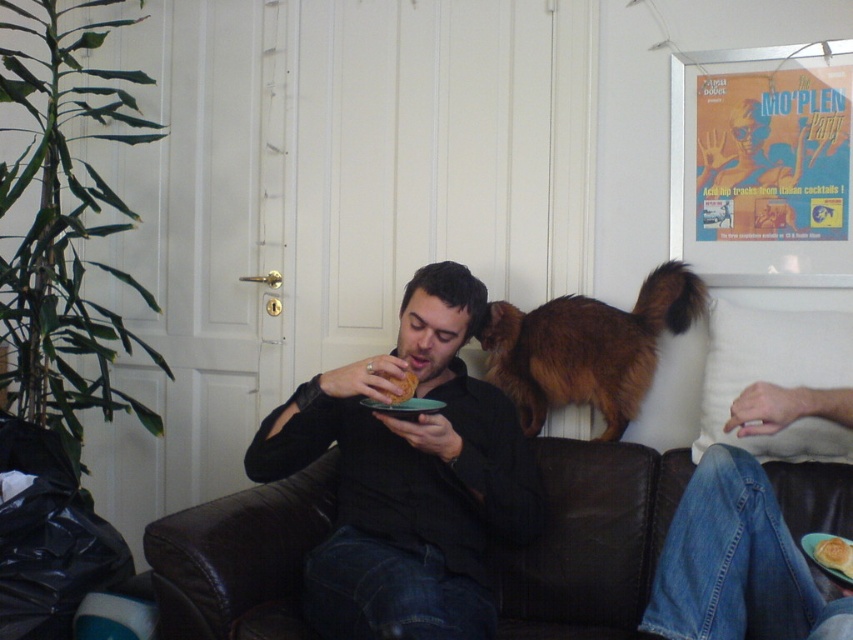
You are standing at the center of the image and want to locate the brown fluffy cat at upper right. Which direction should you look to find it?

The brown fluffy cat at upper right is located at point (587,348), so you should look towards the upper right direction to find it.

From the picture: Please look at the coordinates provided. Is the point at [409,477] located on the black matte shirt at center?

Yes, the point at [409,477] is located on the black matte shirt at center according to the description.